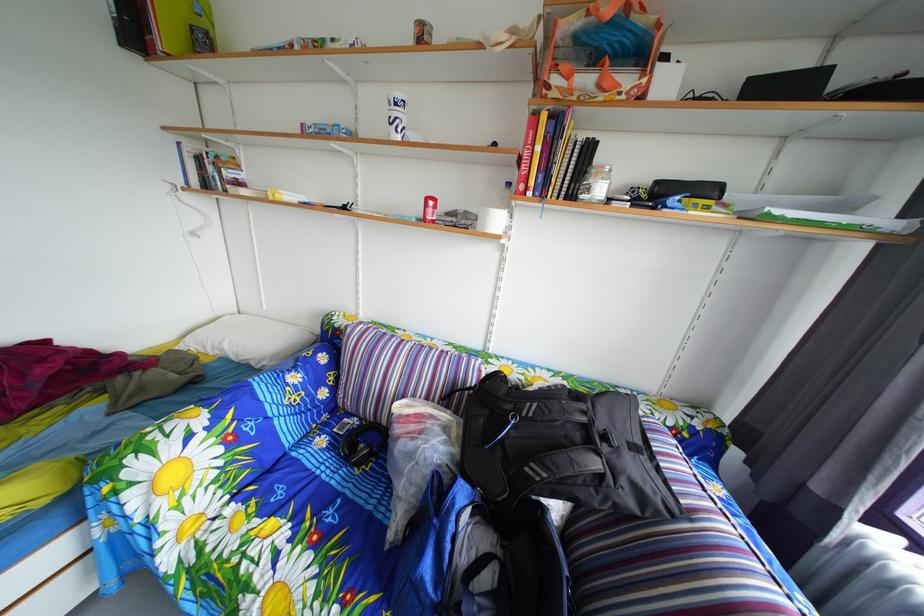
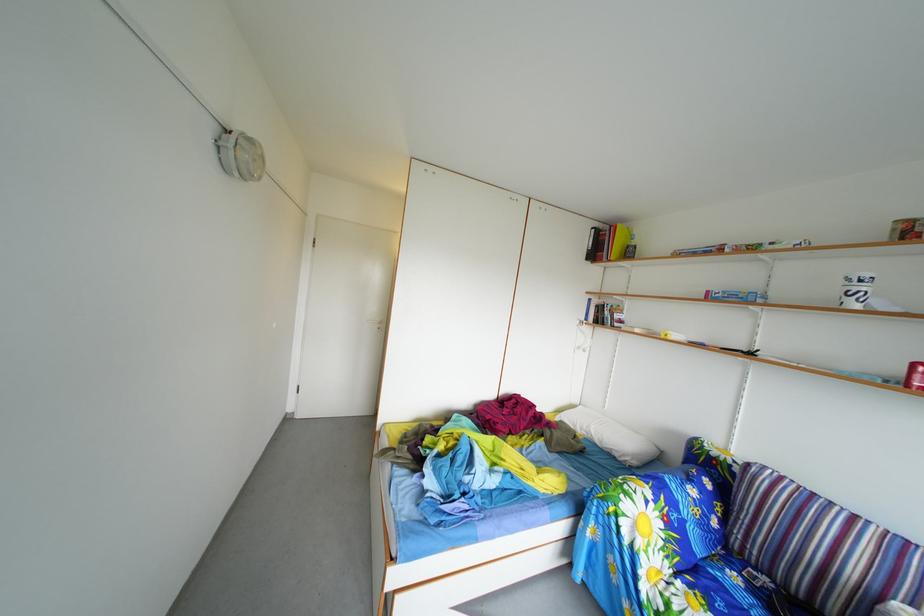
The point at [333,448] is marked in the first image. Where is the corresponding point in the second image?

(746, 585)